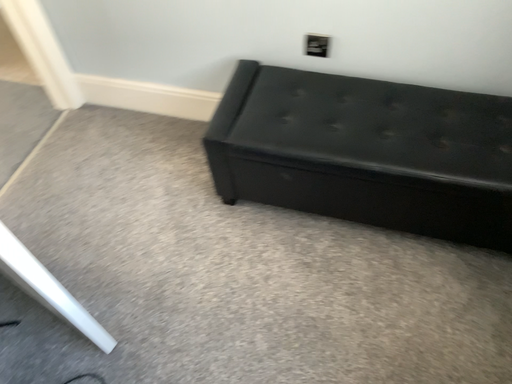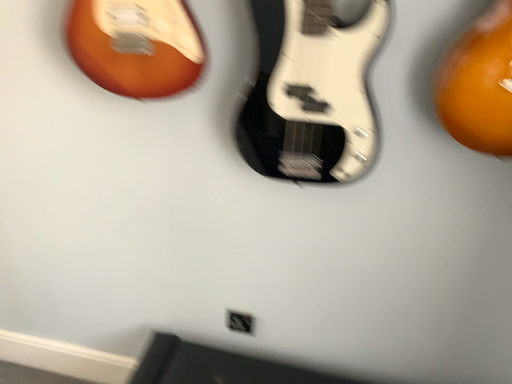
Question: How did the camera likely rotate when shooting the video?

Choices:
 (A) rotated right
 (B) rotated left

Answer: (A)